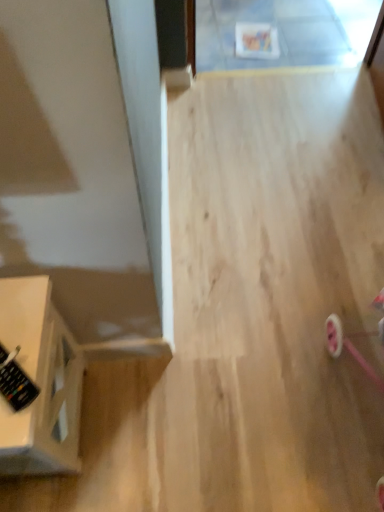
This screenshot has width=384, height=512. What do you see at coordinates (40, 382) in the screenshot?
I see `white glossy side table at left` at bounding box center [40, 382].

The image size is (384, 512). Find the location of `white glossy side table at left`. white glossy side table at left is located at coordinates (40, 382).

What do you see at coordinates (15, 381) in the screenshot? I see `black plastic remote at lower left` at bounding box center [15, 381].

The width and height of the screenshot is (384, 512). In order to click on black plastic remote at lower left in this screenshot , I will do `click(15, 381)`.

The image size is (384, 512). In order to click on white glossy side table at left in this screenshot , I will do `click(40, 382)`.

Is white glossy side table at left to the left of black plastic remote at lower left from the viewer's perspective?

Yes.

Which is in front, white glossy side table at left or black plastic remote at lower left?

white glossy side table at left is closer to the camera.

Does point (29, 469) come behind point (26, 403)?

Yes, point (29, 469) is farther from viewer.

From the image's perspective, which object appears higher, white glossy side table at left or black plastic remote at lower left?

From the image's view, black plastic remote at lower left is above.

From a real-world perspective, is white glossy side table at left physically above black plastic remote at lower left?

Actually, white glossy side table at left is physically below black plastic remote at lower left in the real world.

Between white glossy side table at left and black plastic remote at lower left, which one has larger width?

white glossy side table at left.

Considering the sizes of objects white glossy side table at left and black plastic remote at lower left in the image provided, who is shorter, white glossy side table at left or black plastic remote at lower left?

black plastic remote at lower left is shorter.

Between white glossy side table at left and black plastic remote at lower left, which one has larger size?

white glossy side table at left is bigger.

Is white glossy side table at left spatially inside black plastic remote at lower left, or outside of it?

white glossy side table at left is outside black plastic remote at lower left.

Would you say white glossy side table at left is a long distance from black plastic remote at lower left?

white glossy side table at left is near black plastic remote at lower left, not far away.

Is white glossy side table at left looking in the opposite direction of black plastic remote at lower left?

white glossy side table at left is not turned away from black plastic remote at lower left.

Where is `furniture below the black plastic remote at lower left (from a real-world perspective)`? Image resolution: width=384 pixels, height=512 pixels. furniture below the black plastic remote at lower left (from a real-world perspective) is located at coordinates (40, 382).

Considering the relative positions of black plastic remote at lower left and white glossy side table at left in the image provided, is black plastic remote at lower left to the left of white glossy side table at left from the viewer's perspective?

In fact, black plastic remote at lower left is to the right of white glossy side table at left.

Which object is more forward, black plastic remote at lower left or white glossy side table at left?

white glossy side table at left is more forward.

Between point (24, 387) and point (67, 413), which one is positioned behind?

The point (67, 413) is farther.

From the image's perspective, is black plastic remote at lower left positioned above or below white glossy side table at left?

Based on their image positions, black plastic remote at lower left is located above white glossy side table at left.

From a real-world perspective, is black plastic remote at lower left positioned above or below white glossy side table at left?

Clearly, from a real-world perspective, black plastic remote at lower left is above white glossy side table at left.

Does black plastic remote at lower left have a greater width compared to white glossy side table at left?

No.

Considering the sizes of objects black plastic remote at lower left and white glossy side table at left in the image provided, who is taller, black plastic remote at lower left or white glossy side table at left?

With more height is white glossy side table at left.

Is black plastic remote at lower left smaller than white glossy side table at left?

Yes, black plastic remote at lower left is smaller than white glossy side table at left.

Is black plastic remote at lower left completely or partially outside of white glossy side table at left?

black plastic remote at lower left lies outside white glossy side table at left's area.

Is black plastic remote at lower left touching white glossy side table at left?

No, black plastic remote at lower left is not next to white glossy side table at left.

In the scene shown: Is black plastic remote at lower left oriented away from white glossy side table at left?

No, black plastic remote at lower left is not facing the opposite direction of white glossy side table at left.

How many degrees apart are the facing directions of black plastic remote at lower left and white glossy side table at left?

49.8 degrees separate the facing orientations of black plastic remote at lower left and white glossy side table at left.

Image resolution: width=384 pixels, height=512 pixels. In order to click on control on the right side of white glossy side table at left in this screenshot , I will do `click(15, 381)`.

The height and width of the screenshot is (512, 384). What are the coordinates of `control behind the white glossy side table at left` in the screenshot? It's located at (15, 381).

You are a GUI agent. You are given a task and a screenshot of the screen. Output one action in this format:
    pyautogui.click(x=<x>, y=<y>)
    Task: Click on the control on the right of the white glossy side table at left
    The width and height of the screenshot is (384, 512).
    Given the screenshot: What is the action you would take?
    pyautogui.click(x=15, y=381)